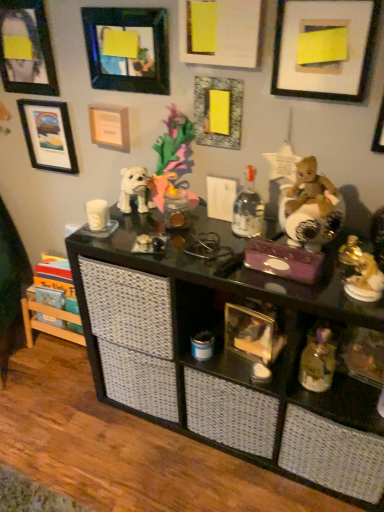
The image size is (384, 512). Identify the location of white matte picture frame at upper center, which is the fifth picture frame in left-to-right order. (220, 32).

Where is `matte white picture frame at upper left, arranged as the 6th picture frame when viewed from the right`? Image resolution: width=384 pixels, height=512 pixels. matte white picture frame at upper left, arranged as the 6th picture frame when viewed from the right is located at coordinates (110, 127).

The image size is (384, 512). I want to click on matte black picture frame at upper left, which is counted as the seventh picture frame, starting from the right, so tap(48, 135).

Where is `gold metallic figurine at right, marked as the 3th toy in a bottom-to-top arrangement`? gold metallic figurine at right, marked as the 3th toy in a bottom-to-top arrangement is located at coordinates (350, 251).

Image resolution: width=384 pixels, height=512 pixels. I want to click on clear glass bottle at center, so click(x=248, y=209).

Where is `translucent plastic figurine at lower right, marked as the fourth toy in a top-to-bottom arrangement`? translucent plastic figurine at lower right, marked as the fourth toy in a top-to-bottom arrangement is located at coordinates (318, 360).

How much space does gold metallic figurine at right, which appears as the 3th toy when viewed from the top, occupy vertically?

gold metallic figurine at right, which appears as the 3th toy when viewed from the top, is 3.95 inches in height.

Describe the element at coordinates (218, 111) in the screenshot. This screenshot has width=384, height=512. I see `matte yellow paper at center, the 3th picture frame positioned from the right` at that location.

Identify the location of white matte picture frame at upper center, placed as the fourth picture frame when sorted from right to left. The height and width of the screenshot is (512, 384). (220, 32).

Is matte black picture frame at upper left, acting as the 2th picture frame starting from the left, completely or partially outside of gold metallic figurine at right, marked as the second toy in a bottom-to-top arrangement?

Yes.

Does matte black picture frame at upper left, which is counted as the seventh picture frame, starting from the right, turn towards gold metallic figurine at right, marked as the second toy in a bottom-to-top arrangement?

No, matte black picture frame at upper left, which is counted as the seventh picture frame, starting from the right, is not aimed at gold metallic figurine at right, marked as the second toy in a bottom-to-top arrangement.

Considering the positions of point (50, 120) and point (379, 289), is point (50, 120) closer or farther from the camera than point (379, 289)?

Point (50, 120) is positioned farther from the camera compared to point (379, 289).

Does matte black picture frame at upper left, which is counted as the seventh picture frame, starting from the right, turn towards black glass shelf at center?

No, matte black picture frame at upper left, which is counted as the seventh picture frame, starting from the right, is not facing towards black glass shelf at center.

In the scene shown: Is matte black picture frame at upper left, acting as the 2th picture frame starting from the left, not within black glass shelf at center?

Yes, matte black picture frame at upper left, acting as the 2th picture frame starting from the left, is located beyond the bounds of black glass shelf at center.

Is matte black picture frame at upper left, acting as the 2th picture frame starting from the left, further to camera compared to black glass shelf at center?

Yes.

Does white matte picture frame at upper center, placed as the fourth picture frame when sorted from right to left, have a larger size compared to shiny gold bear at right, the fourth toy positioned from the bottom?

No.

Do you think white matte picture frame at upper center, which is the fifth picture frame in left-to-right order, is within shiny gold bear at right, the fourth toy positioned from the bottom, or outside of it?

white matte picture frame at upper center, which is the fifth picture frame in left-to-right order, exists outside the volume of shiny gold bear at right, the fourth toy positioned from the bottom.

Is white matte picture frame at upper center, which is the fifth picture frame in left-to-right order, wider or thinner than shiny gold bear at right, the fourth toy positioned from the bottom?

Clearly, white matte picture frame at upper center, which is the fifth picture frame in left-to-right order, has less width compared to shiny gold bear at right, the fourth toy positioned from the bottom.

Is point (243, 2) in front of point (302, 204)?

That is False.

Is clear glass bottle at center bigger than matte black picture frame at upper left, acting as the 2th picture frame starting from the left?

Correct, clear glass bottle at center is larger in size than matte black picture frame at upper left, acting as the 2th picture frame starting from the left.

Which is more to the left, clear glass bottle at center or matte black picture frame at upper left, acting as the 2th picture frame starting from the left?

Positioned to the left is matte black picture frame at upper left, acting as the 2th picture frame starting from the left.

Is point (235, 223) closer to viewer compared to point (68, 167)?

Yes, it is in front of point (68, 167).

From the image's perspective, is clear glass bottle at center above or below matte black picture frame at upper left, which is counted as the seventh picture frame, starting from the right?

clear glass bottle at center is below matte black picture frame at upper left, which is counted as the seventh picture frame, starting from the right.

From the image's perspective, is matte black picture frame at upper left, the eighth picture frame from the right, positioned above or below matte black picture frame at upper center, acting as the fourth picture frame starting from the left?

Clearly, from the image's perspective, matte black picture frame at upper left, the eighth picture frame from the right, is above matte black picture frame at upper center, acting as the fourth picture frame starting from the left.

Would you say matte black picture frame at upper left, the first picture frame viewed from the left, is a long distance from matte black picture frame at upper center, acting as the fourth picture frame starting from the left?

matte black picture frame at upper left, the first picture frame viewed from the left, is near matte black picture frame at upper center, acting as the fourth picture frame starting from the left, not far away.

How far apart are matte black picture frame at upper left, the first picture frame viewed from the left, and matte black picture frame at upper center, acting as the fourth picture frame starting from the left?

matte black picture frame at upper left, the first picture frame viewed from the left, and matte black picture frame at upper center, acting as the fourth picture frame starting from the left, are 12.27 inches apart.

How different are the orientations of matte black picture frame at upper left, the eighth picture frame from the right, and white matte picture frame at upper center, placed as the fourth picture frame when sorted from right to left, in degrees?

0.427 degrees.

The image size is (384, 512). There is a matte black picture frame at upper left, the eighth picture frame from the right. In order to click on the 3rd picture frame above it (from a real-world perspective) in this screenshot , I will do `click(220, 32)`.

From a real-world perspective, between matte black picture frame at upper left, the eighth picture frame from the right, and white matte picture frame at upper center, which is the fifth picture frame in left-to-right order, who is vertically higher?

In real-world perspective, white matte picture frame at upper center, which is the fifth picture frame in left-to-right order, is above.

Can you confirm if matte black picture frame at upper left, the first picture frame viewed from the left, is smaller than white matte picture frame at upper center, placed as the fourth picture frame when sorted from right to left?

Indeed, matte black picture frame at upper left, the first picture frame viewed from the left, has a smaller size compared to white matte picture frame at upper center, placed as the fourth picture frame when sorted from right to left.

Are matte white picture frame at upper left, placed as the 3th picture frame when sorted from left to right, and gold metallic figurine at right, which appears as the 3th toy when viewed from the top, located far from each other?

Actually, matte white picture frame at upper left, placed as the 3th picture frame when sorted from left to right, and gold metallic figurine at right, which appears as the 3th toy when viewed from the top, are a little close together.

Is matte white picture frame at upper left, arranged as the 6th picture frame when viewed from the right, at the right side of gold metallic figurine at right, marked as the second toy in a bottom-to-top arrangement?

No, matte white picture frame at upper left, arranged as the 6th picture frame when viewed from the right, is not to the right of gold metallic figurine at right, marked as the second toy in a bottom-to-top arrangement.

How different are the orientations of matte white picture frame at upper left, placed as the 3th picture frame when sorted from left to right, and gold metallic figurine at right, which appears as the 3th toy when viewed from the top, in degrees?

matte white picture frame at upper left, placed as the 3th picture frame when sorted from left to right, and gold metallic figurine at right, which appears as the 3th toy when viewed from the top, are facing 1.78 degrees away from each other.

Considering the positions of points (93, 135) and (345, 283), is point (93, 135) farther from camera compared to point (345, 283)?

Yes, point (93, 135) is behind point (345, 283).

Find the location of `toy that is the 4th object located in front of the matte black picture frame at upper left, which is counted as the seventh picture frame, starting from the right`. toy that is the 4th object located in front of the matte black picture frame at upper left, which is counted as the seventh picture frame, starting from the right is located at coordinates (365, 280).

Locate an element on the screen. The image size is (384, 512). shelf lying on the right of matte black picture frame at upper left, acting as the 2th picture frame starting from the left is located at coordinates (225, 356).

Considering their positions, is gold metallic figurine at right, acting as the second toy starting from the top, positioned further to metallic silver picture frame at upper right, which is the first picture frame in right-to-left order, than matte black picture frame at upper center, acting as the fourth picture frame starting from the left?

matte black picture frame at upper center, acting as the fourth picture frame starting from the left, lies further to metallic silver picture frame at upper right, which is the first picture frame in right-to-left order, than the other object.

Considering their positions, is matte white frame at upper right, placed as the seventh picture frame when sorted from left to right, positioned further to matte yellow paper at center, the 3th picture frame positioned from the right, than black glass shelf at center?

black glass shelf at center is positioned further to the anchor matte yellow paper at center, the 3th picture frame positioned from the right.

Estimate the real-world distances between objects in this image. Which object is further from matte black picture frame at upper center, acting as the fourth picture frame starting from the left, matte yellow paper at center, the 3th picture frame positioned from the right, or metallic silver picture frame at upper right, positioned as the eighth picture frame in left-to-right order?

Based on the image, metallic silver picture frame at upper right, positioned as the eighth picture frame in left-to-right order, appears to be further to matte black picture frame at upper center, acting as the fourth picture frame starting from the left.

Considering their positions, is clear glass bottle at center positioned closer to matte white picture frame at upper left, placed as the 3th picture frame when sorted from left to right, than matte white frame at upper right, placed as the seventh picture frame when sorted from left to right?

Based on the image, clear glass bottle at center appears to be nearer to matte white picture frame at upper left, placed as the 3th picture frame when sorted from left to right.

Based on the photo, when comparing their distances from gold metallic figurine at right, which appears as the 3th toy when viewed from the top, does matte black picture frame at upper left, the first picture frame viewed from the left, or black glass shelf at center seem closer?

Among the two, black glass shelf at center is located nearer to gold metallic figurine at right, which appears as the 3th toy when viewed from the top.

From the image, which object appears to be nearer to clear glass bottle at center, white matte picture frame at upper center, placed as the fourth picture frame when sorted from right to left, or translucent plastic figurine at lower right, marked as the fourth toy in a top-to-bottom arrangement?

white matte picture frame at upper center, placed as the fourth picture frame when sorted from right to left, is positioned closer to the anchor clear glass bottle at center.

Looking at the image, which one is located closer to metallic silver picture frame at upper right, which is the first picture frame in right-to-left order, translucent plastic figurine at lower right, marked as the fourth toy in a top-to-bottom arrangement, or matte black picture frame at upper left, the first picture frame viewed from the left?

translucent plastic figurine at lower right, marked as the fourth toy in a top-to-bottom arrangement, is closer to metallic silver picture frame at upper right, which is the first picture frame in right-to-left order.

Considering their positions, is clear glass bottle at center positioned further to gold metallic figurine at right, acting as the second toy starting from the top, than shiny gold bear at right, positioned as the first toy in top-to-bottom order?

clear glass bottle at center is further to gold metallic figurine at right, acting as the second toy starting from the top.

This screenshot has height=512, width=384. What are the coordinates of `bottle between matte white frame at upper right, which is counted as the 2th picture frame, starting from the right, and gold metallic figurine at right, which appears as the 3th toy when viewed from the top, vertically` in the screenshot? It's located at (248, 209).

Where is `bottle between matte black picture frame at upper center, which ranks as the fifth picture frame in right-to-left order, and gold metallic figurine at right, marked as the 3th toy in a bottom-to-top arrangement, from top to bottom`? The width and height of the screenshot is (384, 512). bottle between matte black picture frame at upper center, which ranks as the fifth picture frame in right-to-left order, and gold metallic figurine at right, marked as the 3th toy in a bottom-to-top arrangement, from top to bottom is located at coordinates (248, 209).

The width and height of the screenshot is (384, 512). What are the coordinates of `toy between gold metallic figurine at right, acting as the second toy starting from the top, and black glass shelf at center in the up-down direction` in the screenshot? It's located at (365, 280).

Where is `shelf between metallic silver picture frame at upper right, positioned as the eighth picture frame in left-to-right order, and translucent plastic figurine at lower right, marked as the fourth toy in a top-to-bottom arrangement, from top to bottom`? The height and width of the screenshot is (512, 384). shelf between metallic silver picture frame at upper right, positioned as the eighth picture frame in left-to-right order, and translucent plastic figurine at lower right, marked as the fourth toy in a top-to-bottom arrangement, from top to bottom is located at coordinates (225, 356).